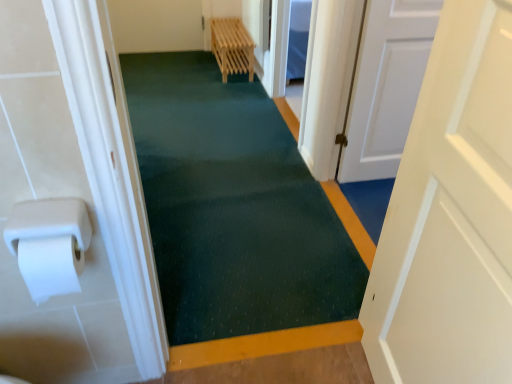
Question: Does white matte paper towel at left come behind green textured carpet at center?

Choices:
 (A) no
 (B) yes

Answer: (A)

Question: Is white matte paper towel at left surrounding green textured carpet at center?

Choices:
 (A) yes
 (B) no

Answer: (B)

Question: Considering the relative positions of white matte paper towel at left and green textured carpet at center in the image provided, is white matte paper towel at left in front of green textured carpet at center?

Choices:
 (A) no
 (B) yes

Answer: (B)

Question: Can you confirm if white matte paper towel at left is taller than green textured carpet at center?

Choices:
 (A) no
 (B) yes

Answer: (B)

Question: From the image's perspective, is white matte paper towel at left under green textured carpet at center?

Choices:
 (A) no
 (B) yes

Answer: (B)

Question: From the image's perspective, is white matte paper towel at left on green textured carpet at center?

Choices:
 (A) yes
 (B) no

Answer: (B)

Question: Does green textured carpet at center have a lesser width compared to white matte door at center, marked as the second door in a front-to-back arrangement?

Choices:
 (A) yes
 (B) no

Answer: (B)

Question: Are green textured carpet at center and white matte door at center, positioned as the second door in left-to-right order, making contact?

Choices:
 (A) yes
 (B) no

Answer: (B)

Question: Are green textured carpet at center and white matte door at center, positioned as the second door in left-to-right order, located far from each other?

Choices:
 (A) no
 (B) yes

Answer: (A)

Question: Is green textured carpet at center taller than white matte door at center, marked as the second door in a front-to-back arrangement?

Choices:
 (A) no
 (B) yes

Answer: (A)

Question: Is green textured carpet at center shorter than white matte door at center, marked as the second door in a front-to-back arrangement?

Choices:
 (A) no
 (B) yes

Answer: (B)

Question: From a real-world perspective, is green textured carpet at center located beneath white matte door at center, which ranks as the first door in back-to-front order?

Choices:
 (A) no
 (B) yes

Answer: (B)

Question: Does white matte paper towel at left have a lesser width compared to white matte door at right, which is the 1th door from left to right?

Choices:
 (A) yes
 (B) no

Answer: (A)